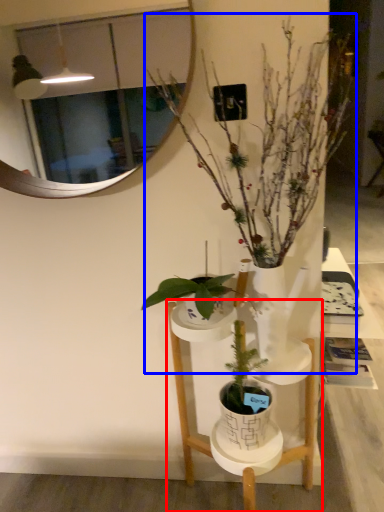
Question: Among these objects, which one is farthest to the camera, furniture (highlighted by a red box) or houseplant (highlighted by a blue box)?

Choices:
 (A) furniture
 (B) houseplant

Answer: (A)